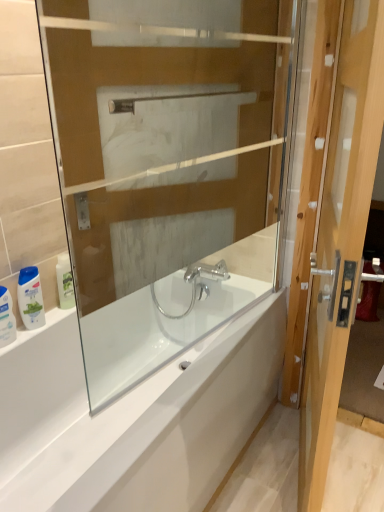
Question: From a real-world perspective, is white glossy shampoo bottle at lower left, which appears as the 2th toiletry when viewed from the right, beneath white glossy bottle at left, which is the third toiletry in left-to-right order?

Choices:
 (A) no
 (B) yes

Answer: (A)

Question: Considering the relative sizes of white glossy shampoo bottle at lower left, which appears as the 2th toiletry when viewed from the right, and white glossy bottle at left, which is the third toiletry in left-to-right order, in the image provided, is white glossy shampoo bottle at lower left, which appears as the 2th toiletry when viewed from the right, bigger than white glossy bottle at left, which is the third toiletry in left-to-right order,?

Choices:
 (A) no
 (B) yes

Answer: (B)

Question: Does white glossy shampoo bottle at lower left, the second toiletry viewed from the left, have a lesser width compared to white glossy bottle at left, arranged as the first toiletry when viewed from the right?

Choices:
 (A) no
 (B) yes

Answer: (A)

Question: Can you confirm if white glossy shampoo bottle at lower left, the second toiletry viewed from the left, is smaller than white glossy bottle at left, which is the third toiletry in left-to-right order?

Choices:
 (A) no
 (B) yes

Answer: (A)

Question: Does white glossy shampoo bottle at lower left, the second toiletry viewed from the left, touch white glossy bottle at left, arranged as the first toiletry when viewed from the right?

Choices:
 (A) yes
 (B) no

Answer: (B)

Question: Considering the positions of white glossy bottle at left, which is the third toiletry in left-to-right order, and white glossy bathtub at center in the image, is white glossy bottle at left, which is the third toiletry in left-to-right order, bigger or smaller than white glossy bathtub at center?

Choices:
 (A) small
 (B) big

Answer: (A)

Question: From the image's perspective, is white glossy bottle at left, which is the third toiletry in left-to-right order, located above or below white glossy bathtub at center?

Choices:
 (A) below
 (B) above

Answer: (B)

Question: Is point (59, 298) positioned closer to the camera than point (283, 348)?

Choices:
 (A) closer
 (B) farther

Answer: (A)

Question: Would you say white glossy bottle at left, arranged as the first toiletry when viewed from the right, is to the left or to the right of white glossy bathtub at center in the picture?

Choices:
 (A) left
 (B) right

Answer: (A)

Question: In the image, is light brown wooden door at right positioned in front of or behind white glossy shampoo bottle at lower left, the second toiletry viewed from the left?

Choices:
 (A) behind
 (B) front

Answer: (B)

Question: From the image's perspective, is light brown wooden door at right above or below white glossy shampoo bottle at lower left, which appears as the 2th toiletry when viewed from the right?

Choices:
 (A) above
 (B) below

Answer: (A)

Question: In terms of size, does light brown wooden door at right appear bigger or smaller than white glossy shampoo bottle at lower left, the second toiletry viewed from the left?

Choices:
 (A) small
 (B) big

Answer: (B)

Question: Is light brown wooden door at right taller or shorter than white glossy shampoo bottle at lower left, the second toiletry viewed from the left?

Choices:
 (A) short
 (B) tall

Answer: (B)

Question: Is light brown wooden door at right inside or outside of white glossy bathtub at center?

Choices:
 (A) outside
 (B) inside

Answer: (A)

Question: Is light brown wooden door at right to the left or to the right of white glossy bathtub at center in the image?

Choices:
 (A) left
 (B) right

Answer: (B)